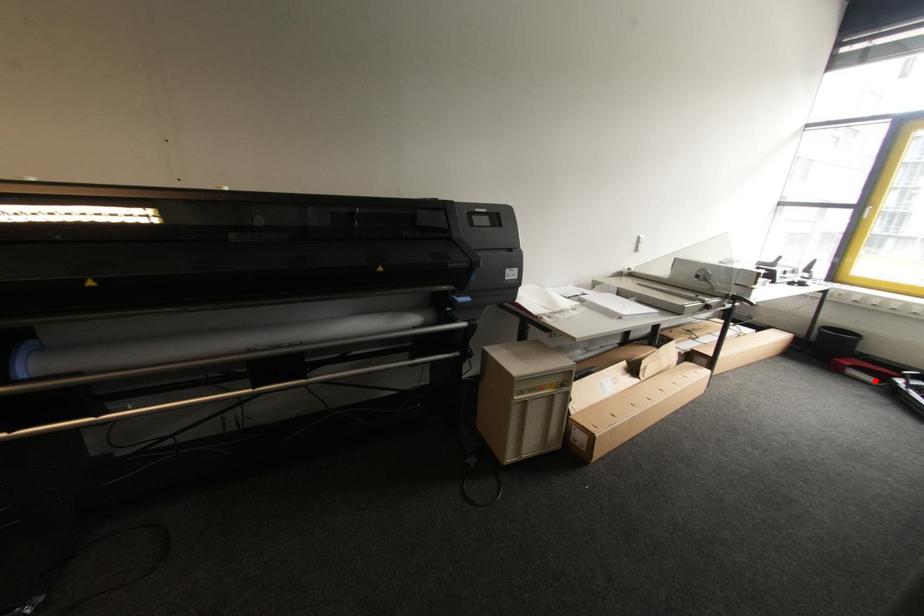
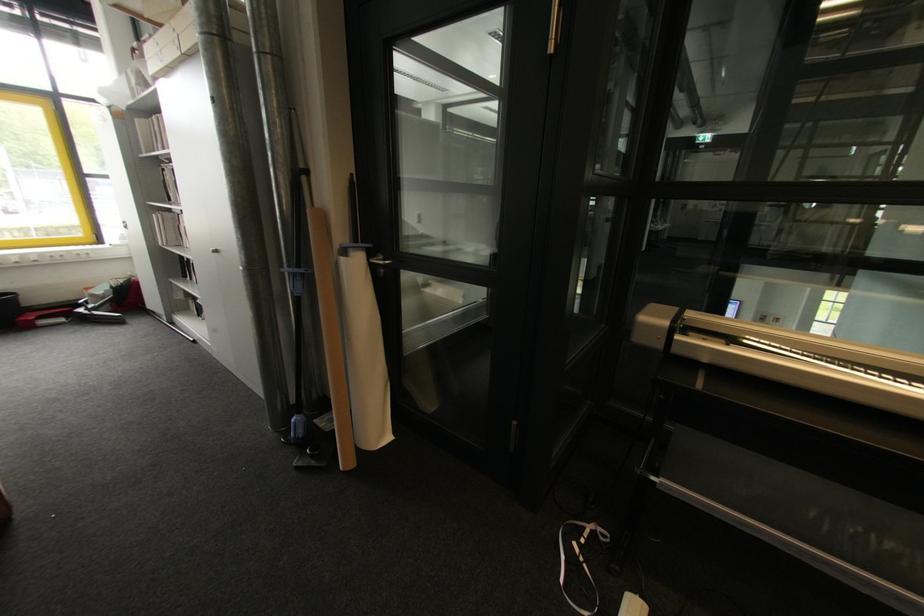
Find the pixel in the second image that matches the highlighted location in the first image.

(66, 321)